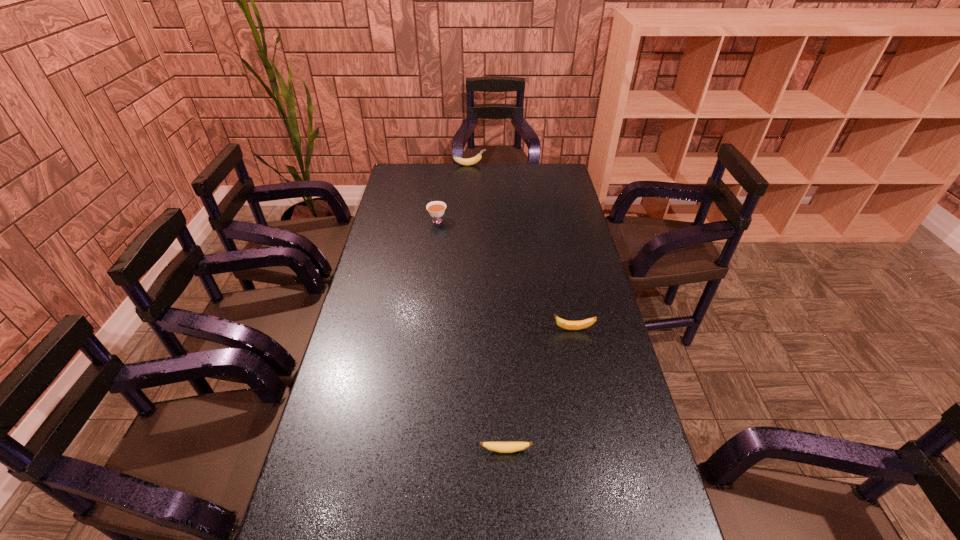
I want to click on object that stands as the second closest to the second shortest banana, so click(x=436, y=209).

Point out which object is positioned as the third nearest to the nearest banana. Please provide its 2D coordinates. Your answer should be formatted as a tuple, i.e. [(x, y)], where the tuple contains the x and y coordinates of a point satisfying the conditions above.

[(470, 161)]

You are a GUI agent. You are given a task and a screenshot of the screen. Output one action in this format:
    pyautogui.click(x=<x>, y=<y>)
    Task: Click on the banana that is the second closest to the farthest banana
    The width and height of the screenshot is (960, 540).
    Given the screenshot: What is the action you would take?
    pyautogui.click(x=501, y=447)

You are a GUI agent. You are given a task and a screenshot of the screen. Output one action in this format:
    pyautogui.click(x=<x>, y=<y>)
    Task: Click on the banana that is the closest one to the nearest object
    This screenshot has height=540, width=960.
    Given the screenshot: What is the action you would take?
    pyautogui.click(x=568, y=325)

Locate an element on the screen. This screenshot has height=540, width=960. free spot that satisfies the following two spatial constraints: 1. on the side of the teacup with the handle; 2. on the left side of the nearest object is located at coordinates (409, 450).

The image size is (960, 540). Identify the location of free region that satisfies the following two spatial constraints: 1. on the side of the leftmost object with the handle; 2. on the left side of the shortest banana. (409, 450).

Where is `vacant space that satisfies the following two spatial constraints: 1. at the stem of the farthest banana; 2. on the back side of the shortest object`? Image resolution: width=960 pixels, height=540 pixels. vacant space that satisfies the following two spatial constraints: 1. at the stem of the farthest banana; 2. on the back side of the shortest object is located at coordinates pos(460,450).

Where is `blank area in the image that satisfies the following two spatial constraints: 1. at the stem of the farthest object; 2. on the back side of the shortest banana`? The height and width of the screenshot is (540, 960). blank area in the image that satisfies the following two spatial constraints: 1. at the stem of the farthest object; 2. on the back side of the shortest banana is located at coordinates (460, 450).